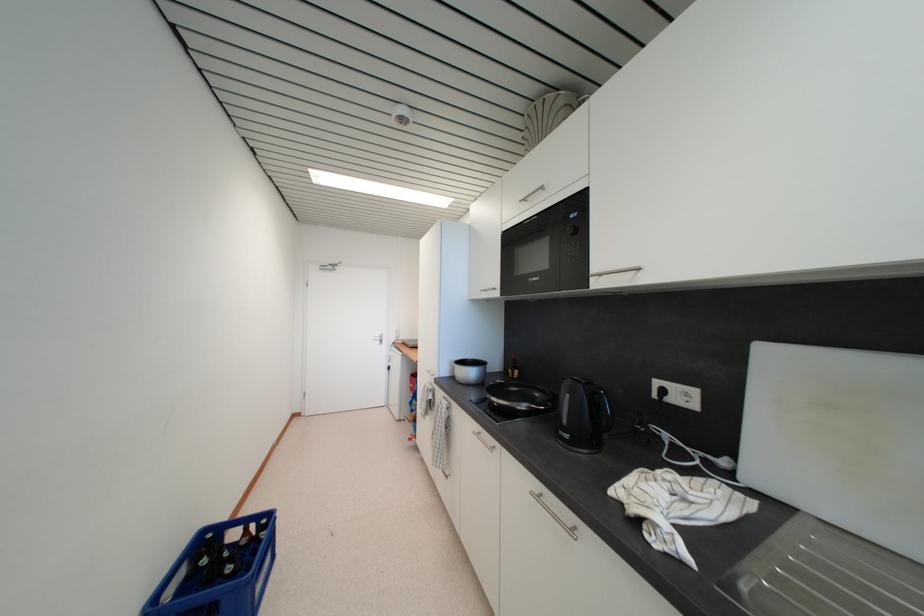
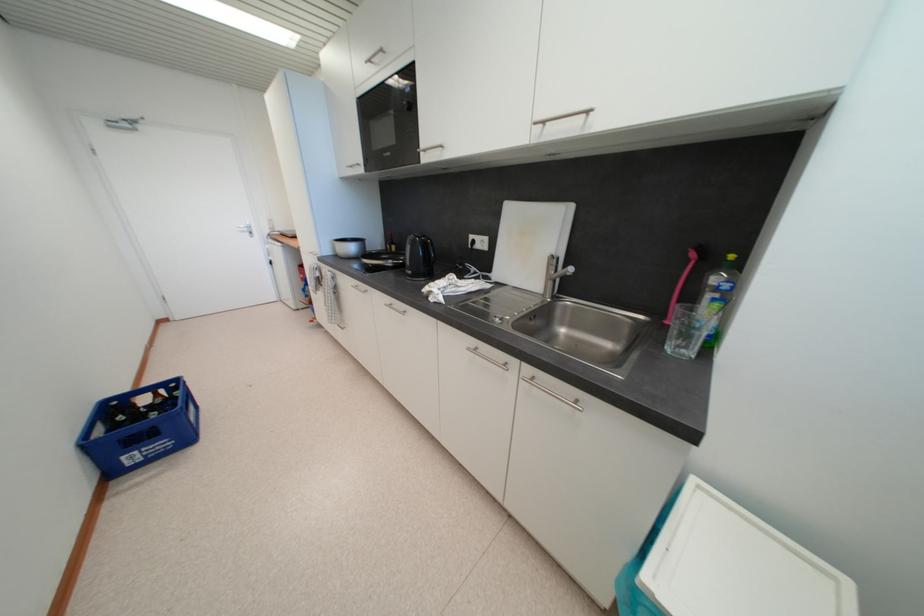
First-person continuous shooting, in which direction is the camera rotating?

The rotation direction of the camera is right-down.